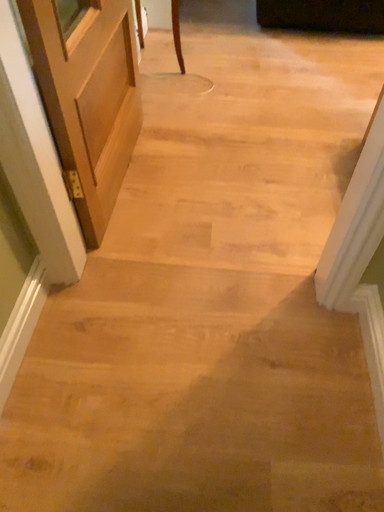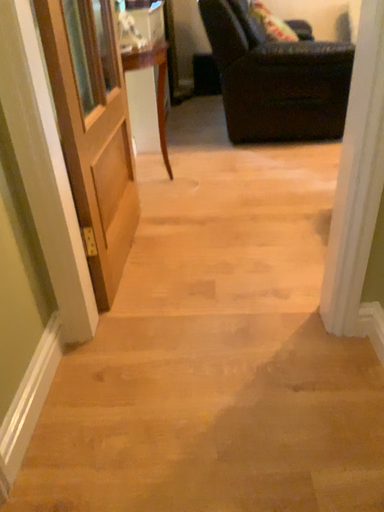
Question: Which way did the camera rotate in the video?

Choices:
 (A) rotated upward
 (B) rotated downward

Answer: (A)